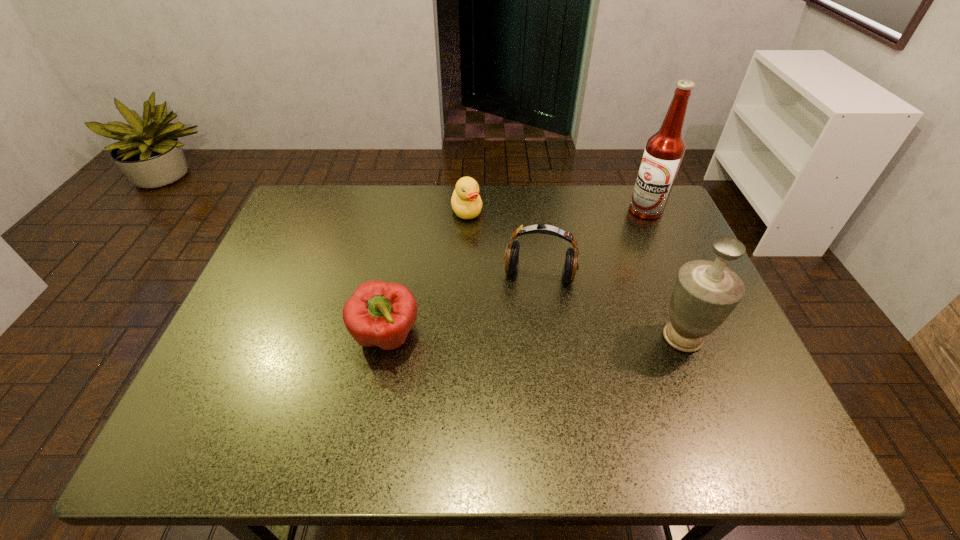
What are the coordinates of `free region located on the label side of the tallest object` in the screenshot? It's located at (632, 235).

Image resolution: width=960 pixels, height=540 pixels. I want to click on vacant area situated 0.270m on the label side of the tallest object, so click(x=610, y=272).

The width and height of the screenshot is (960, 540). Find the location of `vacant point located at the beak of the second object from left to right`. vacant point located at the beak of the second object from left to right is located at coordinates (476, 250).

This screenshot has height=540, width=960. Find the location of `blank space located at the beak of the second object from left to right`. blank space located at the beak of the second object from left to right is located at coordinates coord(489,300).

Where is `vacant space located at the beak of the second object from left to right`? vacant space located at the beak of the second object from left to right is located at coordinates (478, 260).

Locate an element on the screen. This screenshot has height=540, width=960. vacant space located 0.180m on the ear cups of the headset is located at coordinates (525, 346).

Locate an element on the screen. This screenshot has width=960, height=540. vacant area located 0.070m on the ear cups of the headset is located at coordinates click(x=531, y=309).

The height and width of the screenshot is (540, 960). In order to click on vacant space located 0.180m on the ear cups of the headset in this screenshot , I will do `click(525, 346)`.

Identify the location of alcohol at the far edge. (664, 151).

This screenshot has width=960, height=540. Identify the location of duck that is positioned at the far edge. (466, 203).